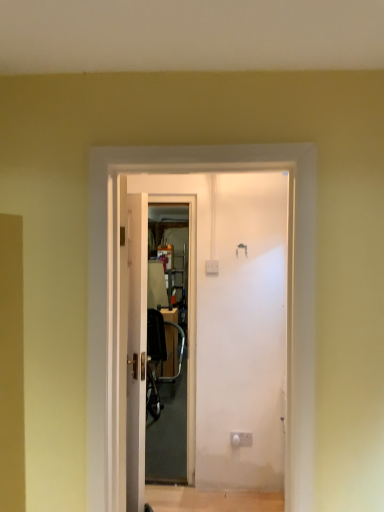
Question: Considering the relative positions of metallic silver chair at center and white glossy door at center in the image provided, is metallic silver chair at center to the left or to the right of white glossy door at center?

Choices:
 (A) right
 (B) left

Answer: (A)

Question: Considering the positions of point (147, 394) and point (132, 464), is point (147, 394) closer or farther from the camera than point (132, 464)?

Choices:
 (A) closer
 (B) farther

Answer: (B)

Question: Which of these objects is positioned farthest from the transparent plastic screen door at center?

Choices:
 (A) white glossy door at center
 (B) metallic silver chair at center

Answer: (A)

Question: Which is farther from the white glossy door at center?

Choices:
 (A) transparent plastic screen door at center
 (B) metallic silver chair at center

Answer: (B)